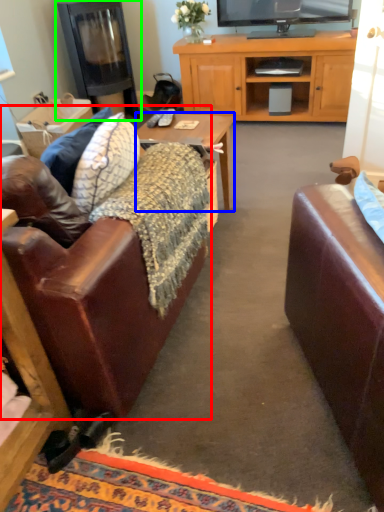
Question: Which object is positioned closest to studio couch (highlighted by a red box)? Select from desk (highlighted by a blue box) and fireplace (highlighted by a green box).

Choices:
 (A) desk
 (B) fireplace

Answer: (A)